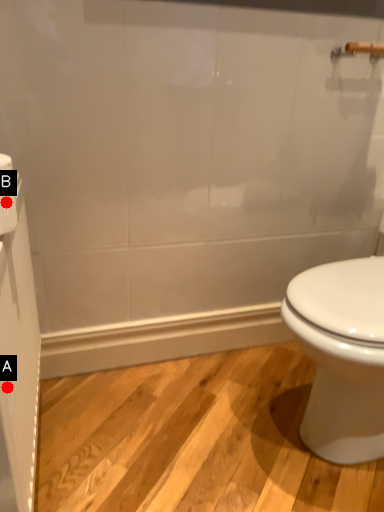
Question: Two points are circled on the image, labeled by A and B beside each circle. Among these points, which one is nearest to the camera?

Choices:
 (A) A is closer
 (B) B is closer

Answer: (A)